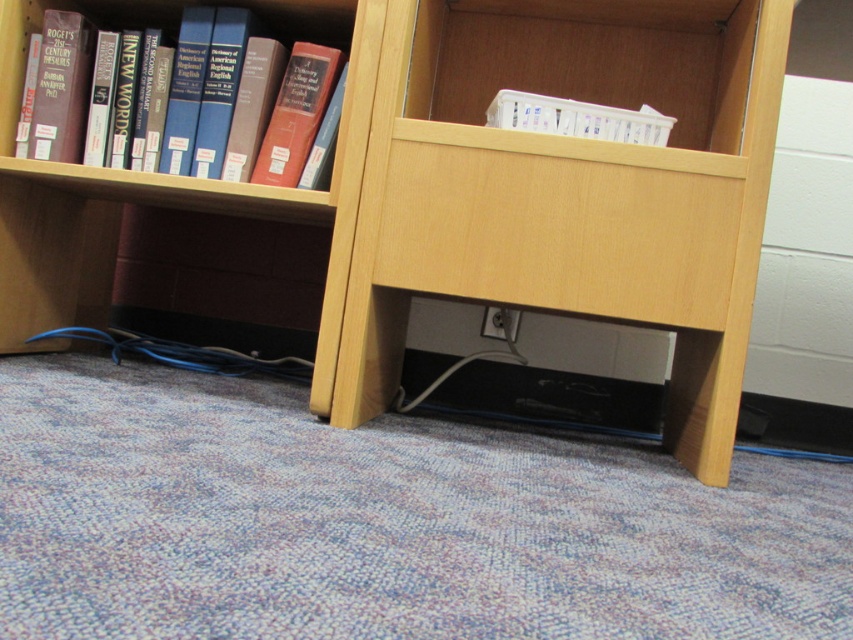
The height and width of the screenshot is (640, 853). Find the location of `wooden bookshelf at lower center`. wooden bookshelf at lower center is located at coordinates (183, 205).

Can you confirm if wooden bookshelf at lower center is taller than matte red book at center?

Indeed, wooden bookshelf at lower center has a greater height compared to matte red book at center.

Between point (59, 195) and point (281, 154), which one is positioned behind?

The point (59, 195) is behind.

Where is `wooden bookshelf at lower center`? wooden bookshelf at lower center is located at coordinates (183, 205).

The width and height of the screenshot is (853, 640). What do you see at coordinates (560, 225) in the screenshot? I see `light wood drawer at center` at bounding box center [560, 225].

Which is more to the right, light wood drawer at center or white plastic container at upper center?

From the viewer's perspective, white plastic container at upper center appears more on the right side.

Describe the element at coordinates (560, 225) in the screenshot. I see `light wood drawer at center` at that location.

Locate an element on the screen. The width and height of the screenshot is (853, 640). light wood drawer at center is located at coordinates (560, 225).

Is matte blue book at left shorter than hardcover book at center?

No, matte blue book at left is not shorter than hardcover book at center.

Does matte blue book at left come in front of hardcover book at center?

No.

Where is `matte blue book at left`? matte blue book at left is located at coordinates (158, 26).

The width and height of the screenshot is (853, 640). In order to click on matte blue book at left in this screenshot , I will do `click(158, 26)`.